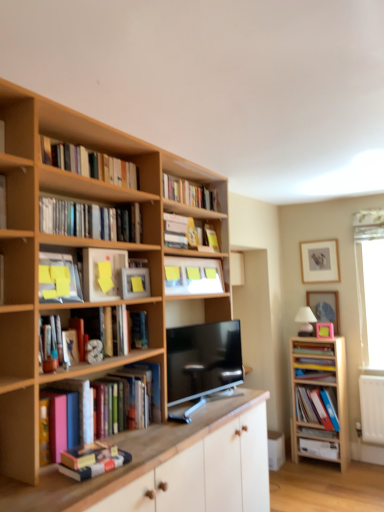
I want to click on free location to the right of hardcover book at lower left, which is counted as the seventh book, starting from the top, so click(x=144, y=457).